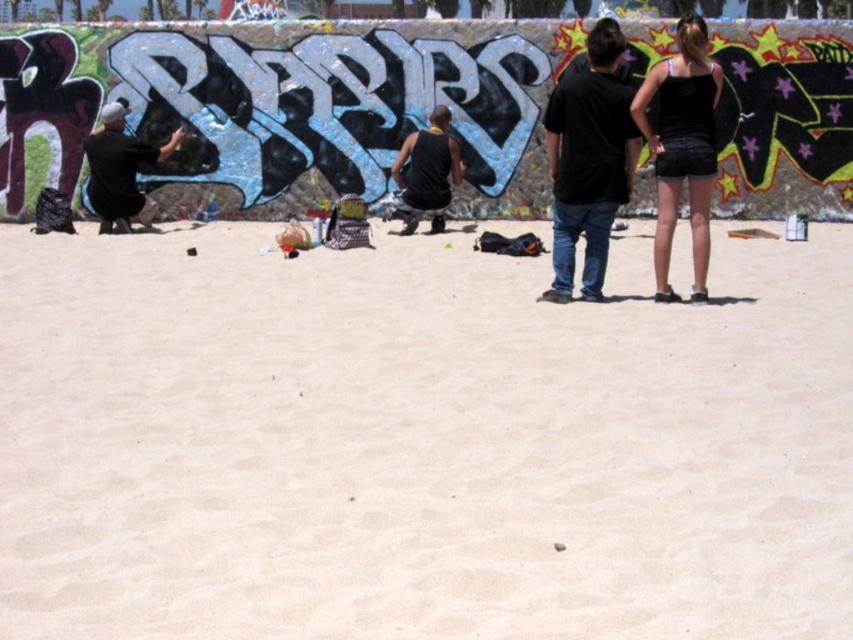
You are a photographer wanting to capture both the black matte shirt at left and the black tank top at center in a single shot. Since you want to ensure both are visible, which person should be closer to the camera?

The black tank top at center is behind the black matte shirt at left, so the black matte shirt at left should be closer to the camera to ensure both are visible in the frame.

You are a photographer at the beach scene. You need to capture a photo that includes both the black matte shirt at left and the black tank top at center. Based on their positions, which one should you focus on first to ensure both are in frame?

The black matte shirt at left is located below the black tank top at center. To ensure both are in frame, focus on the black tank top at center first as it is higher up, allowing the camera to capture the lower positioned black matte shirt at left in the same shot.

You are standing at the center of the image and want to find the black matte shirt at left. Which direction should you look to locate it?

The black matte shirt at left is located at point 0.267 on the x axis and 0.142 on the y axis. Since the x coordinate is 0.267, which is less than 0.5, it is positioned to the left side of the image. Therefore, you should look to the left to find the black matte shirt at left.